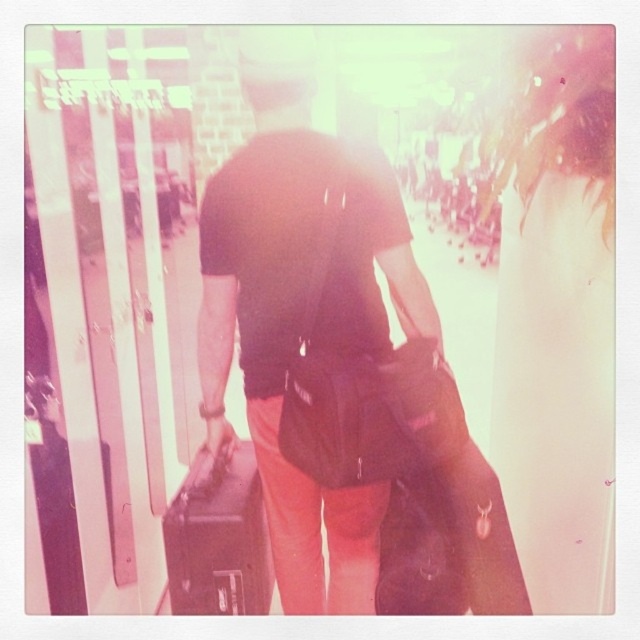
This screenshot has width=640, height=640. What do you see at coordinates (300, 307) in the screenshot? I see `matte black bag at center` at bounding box center [300, 307].

Does point (308, 566) lie behind point (394, 547)?

Yes, point (308, 566) is farther from viewer.

Locate an element on the screen. The image size is (640, 640). matte black bag at center is located at coordinates (300, 307).

Between matte black bag at center and matte black suitcase at center, which one is positioned lower?

matte black suitcase at center is lower down.

Identify the location of matte black bag at center. The height and width of the screenshot is (640, 640). pyautogui.click(x=300, y=307).

Where is `matte black bag at center`? matte black bag at center is located at coordinates (300, 307).

Who is more distant from viewer, [246,499] or [381,600]?

The point [246,499] is more distant.

Is point (170, 547) positioned after point (422, 524)?

Yes, point (170, 547) is behind point (422, 524).

Locate an element on the screen. Image resolution: width=640 pixels, height=640 pixels. matte black suitcase at center is located at coordinates (218, 538).

This screenshot has width=640, height=640. I want to click on matte black suitcase at center, so click(218, 538).